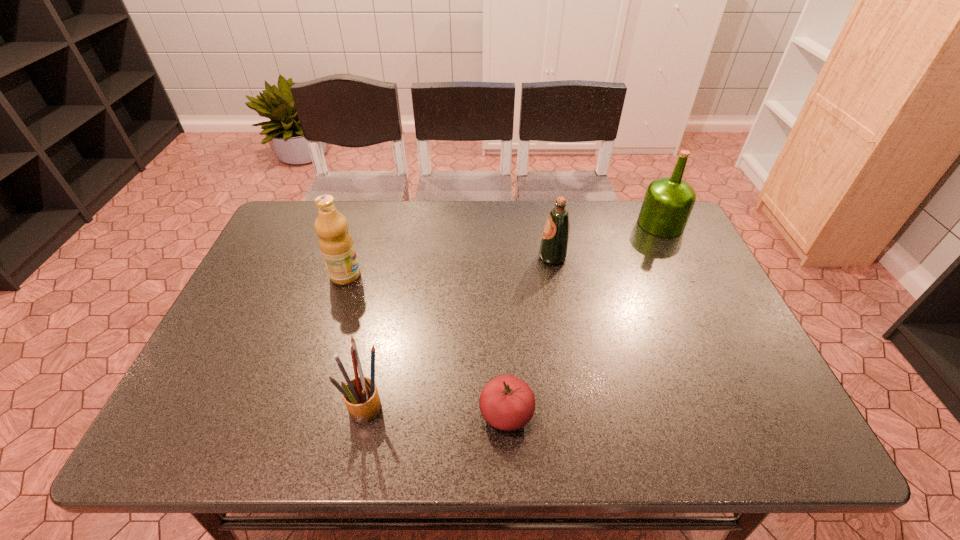
The width and height of the screenshot is (960, 540). Identify the location of vacant region that satisfies the following two spatial constraints: 1. on the label of the tomato; 2. on the right side of the leftmost object. (301, 414).

Identify the location of free location that satisfies the following two spatial constraints: 1. on the label of the leftmost object; 2. on the right side of the third object from right to left. (301, 414).

At what (x,y) coordinates should I click in order to perform the action: click on free region that satisfies the following two spatial constraints: 1. on the label of the third object from left to right; 2. on the right side of the leftmost olive oil. Please return your answer as a coordinate pair (x, y). Looking at the image, I should click on (301, 414).